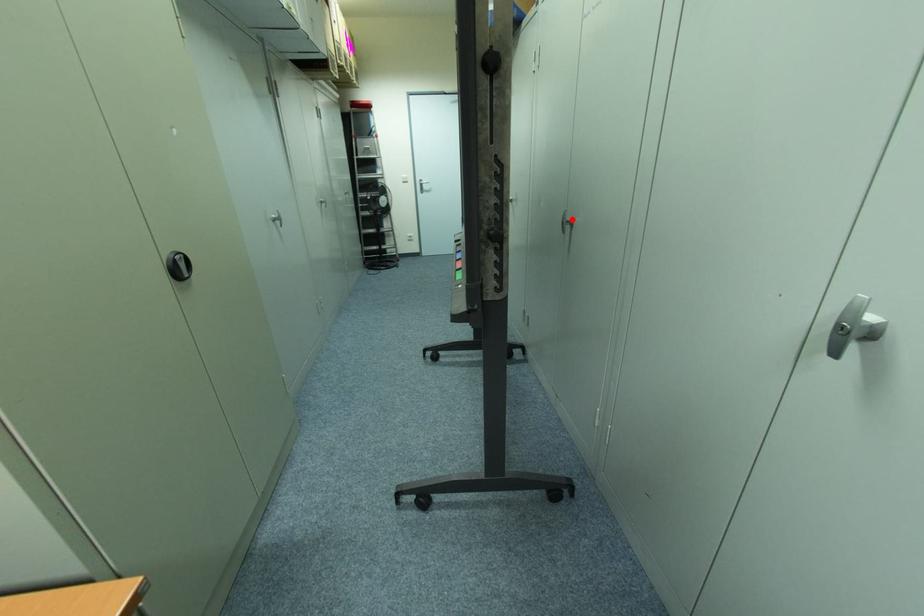
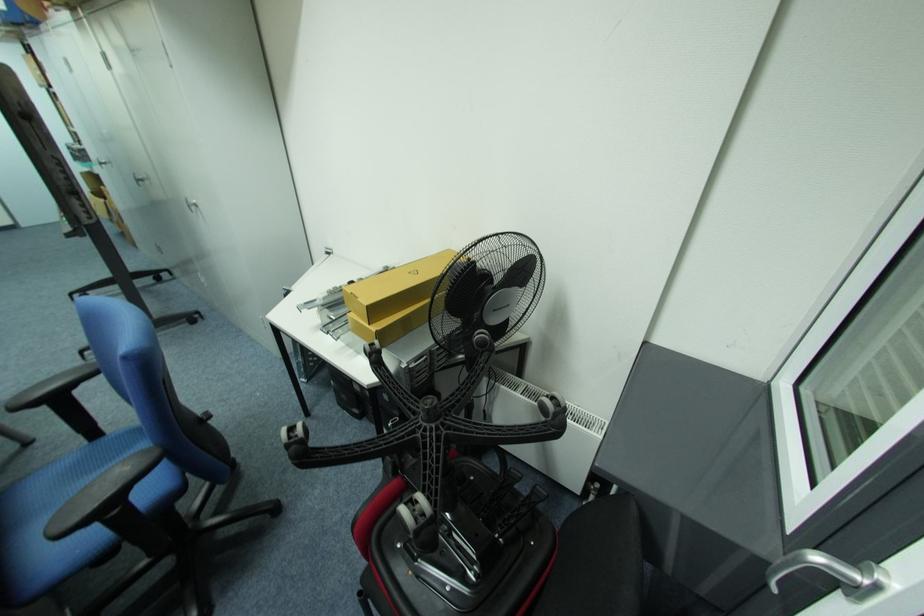
Question: I am providing you with two images of the same scene from different viewpoints. A red point is marked on the first image. At the location where the point appears in image 1, is it still visible in image 2?

Choices:
 (A) Yes
 (B) No

Answer: (A)